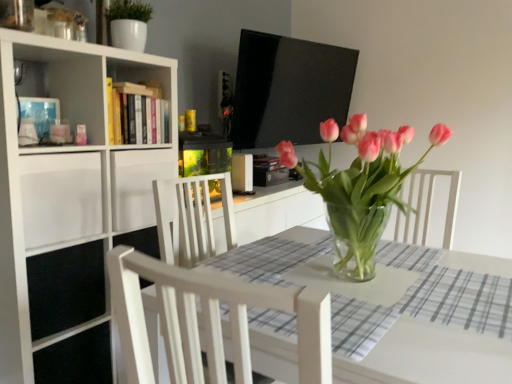
Question: Is point (134, 16) positioned closer to the camera than point (77, 339)?

Choices:
 (A) closer
 (B) farther

Answer: (B)

Question: From the image's perspective, relative to white matte bookcase at left, is white glossy pot at upper left above or below?

Choices:
 (A) above
 (B) below

Answer: (A)

Question: Estimate the real-world distances between objects in this image. Which object is farther from the pink glass vase at center?

Choices:
 (A) white matte drawer at left, marked as the 2th drawer in a right-to-left arrangement
 (B) white glossy pot at upper left
 (C) white matte bookcase at left
 (D) white matte drawer at left, which is the 1th drawer in right-to-left order
 (E) gray checkered tablecloth at center

Answer: (B)

Question: Estimate the real-world distances between objects in this image. Which object is farther from the clear glass table at center?

Choices:
 (A) pink glass vase at center
 (B) gray checkered tablecloth at center
 (C) white matte drawer at left, marked as the 2th drawer in a right-to-left arrangement
 (D) white matte bookcase at left
 (E) hardcover book at upper center

Answer: (E)